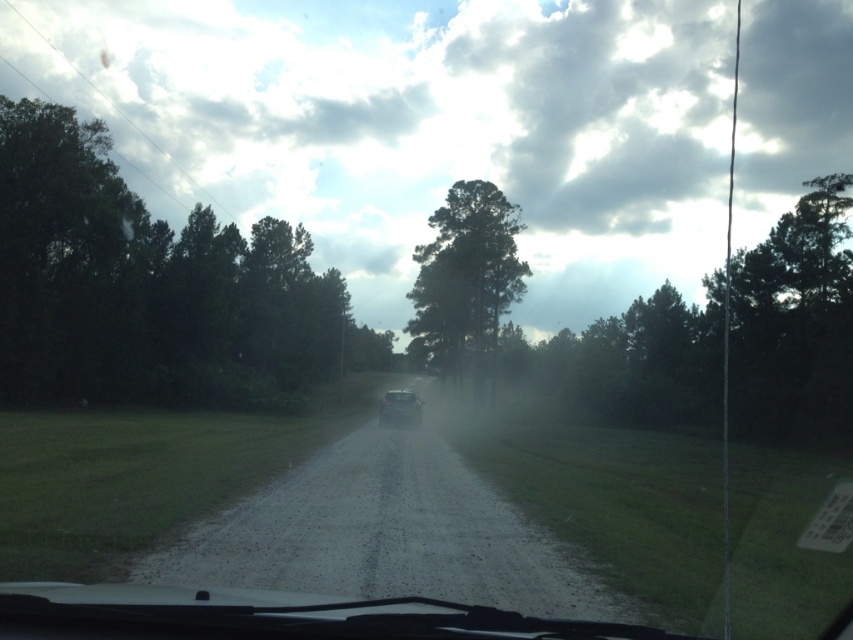
You are driving a shiny silver car at center and want to avoid hitting the green matte tree at center. Can you safely move to the right to go around it?

The green matte tree at center is closer to you than the shiny silver car at center, so you cannot safely move to the right to go around it because the tree is in front of the car.

You are driving a car and looking out through the windshield. You notice dark green foliage at left and a green matte tree at center. Which of these two objects is closer to your car?

The dark green foliage at left is closer to your car because it is positioned in front of the green matte tree at center, indicating it is nearer to the observer.

You are driving a car and want to know how far the dark green foliage at left is from your current position. Can you determine the distance based on the scene?

The dark green foliage at left is 39.30 meters away from the viewer.